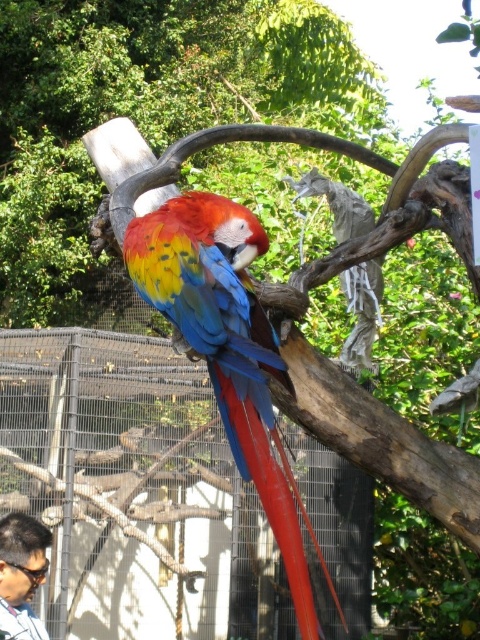
What are the coordinates of the shiny multicolored parrot at center?

The shiny multicolored parrot at center is located at coordinates point (228,349).

You are a zookeeper observing the enclosure. You need to determine if the shiny multicolored parrot at center can comfortably turn around without touching the dark brown hair at lower left. Based on their sizes, what do you think?

The shiny multicolored parrot at center is larger in width than the dark brown hair at lower left. Since the parrot is wider, it may have sufficient space to turn around without touching the dark brown hair at lower left, provided the enclosure allows for its size.